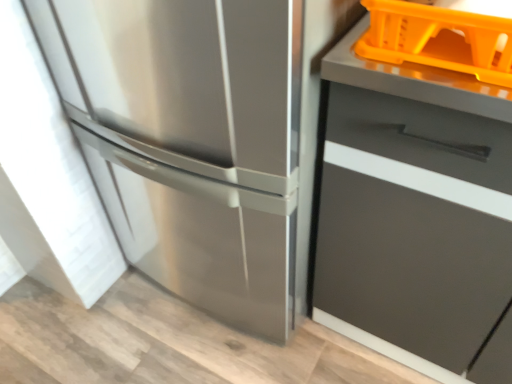
Question: Would you consider stainless steel refrigerator at left to be distant from matte gray drawer at right?

Choices:
 (A) no
 (B) yes

Answer: (A)

Question: From a real-world perspective, is stainless steel refrigerator at left physically above matte gray drawer at right?

Choices:
 (A) no
 (B) yes

Answer: (B)

Question: Is matte gray drawer at right at the back of stainless steel refrigerator at left?

Choices:
 (A) yes
 (B) no

Answer: (B)

Question: Is stainless steel refrigerator at left aimed at matte gray drawer at right?

Choices:
 (A) yes
 (B) no

Answer: (B)

Question: Is stainless steel refrigerator at left to the left of matte gray drawer at right from the viewer's perspective?

Choices:
 (A) no
 (B) yes

Answer: (B)

Question: Can matte gray drawer at right be found inside stainless steel refrigerator at left?

Choices:
 (A) yes
 (B) no

Answer: (B)

Question: Can you confirm if orange plastic basket at upper right is shorter than matte gray drawer at right?

Choices:
 (A) no
 (B) yes

Answer: (B)

Question: Considering the relative sizes of orange plastic basket at upper right and matte gray drawer at right in the image provided, is orange plastic basket at upper right smaller than matte gray drawer at right?

Choices:
 (A) yes
 (B) no

Answer: (A)

Question: Is orange plastic basket at upper right to the right of matte gray drawer at right from the viewer's perspective?

Choices:
 (A) no
 (B) yes

Answer: (A)

Question: Is orange plastic basket at upper right looking in the opposite direction of matte gray drawer at right?

Choices:
 (A) no
 (B) yes

Answer: (A)

Question: Does orange plastic basket at upper right have a larger size compared to matte gray drawer at right?

Choices:
 (A) yes
 (B) no

Answer: (B)

Question: From the image's perspective, is orange plastic basket at upper right above matte gray drawer at right?

Choices:
 (A) no
 (B) yes

Answer: (B)

Question: Is stainless steel refrigerator at left positioned with its back to orange plastic basket at upper right?

Choices:
 (A) yes
 (B) no

Answer: (B)